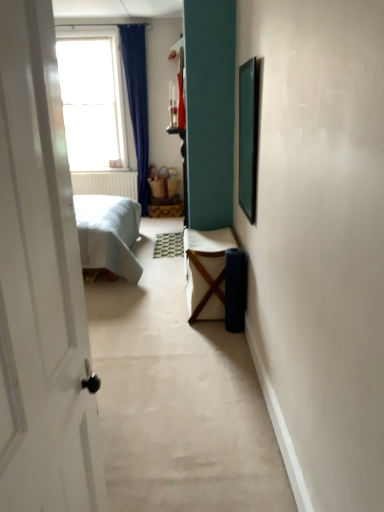
The image size is (384, 512). What do you see at coordinates (93, 100) in the screenshot?
I see `transparent glass window at upper left` at bounding box center [93, 100].

You are a GUI agent. You are given a task and a screenshot of the screen. Output one action in this format:
    pyautogui.click(x=<x>, y=<y>)
    Task: Click on the white fabric chair at center
    The width and height of the screenshot is (384, 512).
    Given the screenshot: What is the action you would take?
    pyautogui.click(x=206, y=272)

The image size is (384, 512). What are the coordinates of `green matte picture frame at upper right` in the screenshot? It's located at (248, 137).

At what (x,y) coordinates should I click in order to perform the action: click on transparent glass window at upper left. Please return your answer as a coordinate pair (x, y). Image resolution: width=384 pixels, height=512 pixels. Looking at the image, I should click on (93, 100).

From a real-world perspective, relative to transparent glass window at upper left, is green matte picture frame at upper right vertically above or below?

green matte picture frame at upper right is situated lower than transparent glass window at upper left in the real world.

Considering the sizes of objects green matte picture frame at upper right and transparent glass window at upper left in the image provided, who is bigger, green matte picture frame at upper right or transparent glass window at upper left?

With larger size is transparent glass window at upper left.

Considering the sizes of objects green matte picture frame at upper right and transparent glass window at upper left in the image provided, who is taller, green matte picture frame at upper right or transparent glass window at upper left?

transparent glass window at upper left.

Can you confirm if green matte picture frame at upper right is positioned to the left of transparent glass window at upper left?

In fact, green matte picture frame at upper right is to the right of transparent glass window at upper left.

What's the angular difference between white fabric chair at center and green matte picture frame at upper right's facing directions?

They differ by 0.00207 degrees in their facing directions.

Considering the points (198, 232) and (253, 178), which point is behind, point (198, 232) or point (253, 178)?

The point (198, 232) is more distant.

From the image's perspective, who appears lower, white fabric chair at center or green matte picture frame at upper right?

white fabric chair at center, from the image's perspective.

Would you say transparent glass window at upper left is a long distance from green matte picture frame at upper right?

Indeed, transparent glass window at upper left is not near green matte picture frame at upper right.

Does transparent glass window at upper left have a greater width compared to green matte picture frame at upper right?

Yes, transparent glass window at upper left is wider than green matte picture frame at upper right.

Considering the positions of objects transparent glass window at upper left and green matte picture frame at upper right in the image provided, who is more to the left, transparent glass window at upper left or green matte picture frame at upper right?

transparent glass window at upper left is more to the left.

Does point (124, 168) come farther from viewer compared to point (246, 184)?

That is True.

Who is smaller, white fabric chair at center or transparent glass window at upper left?

white fabric chair at center is smaller.

Can you see white fabric chair at center touching transparent glass window at upper left?

No, white fabric chair at center is not touching transparent glass window at upper left.

Looking at this image, is white fabric chair at center turned away from transparent glass window at upper left?

No, white fabric chair at center is not facing away from transparent glass window at upper left.

How far apart are white fabric chair at center and transparent glass window at upper left?

2.99 meters.

Looking at this image, from the image's perspective, is green matte picture frame at upper right located above or below white fabric chair at center?

Clearly, from the image's perspective, green matte picture frame at upper right is above white fabric chair at center.

Is point (250, 75) positioned in front of point (221, 300)?

Yes, point (250, 75) is closer to viewer.

Can you tell me how much green matte picture frame at upper right and white fabric chair at center differ in facing direction?

The facing directions of green matte picture frame at upper right and white fabric chair at center are 0.00207 degrees apart.

Is green matte picture frame at upper right bigger or smaller than white fabric chair at center?

Considering their sizes, green matte picture frame at upper right takes up less space than white fabric chair at center.

Which object is further away from the camera taking this photo, transparent glass window at upper left or white fabric chair at center?

transparent glass window at upper left is more distant.

Is transparent glass window at upper left outside of white fabric chair at center?

Yes, transparent glass window at upper left is outside of white fabric chair at center.

Is transparent glass window at upper left next to white fabric chair at center?

No, transparent glass window at upper left is not in contact with white fabric chair at center.

Is transparent glass window at upper left looking in the opposite direction of white fabric chair at center?

transparent glass window at upper left does not have its back to white fabric chair at center.

At what (x,y) coordinates should I click in order to perform the action: click on picture frame lying below the transparent glass window at upper left (from the image's perspective). Please return your answer as a coordinate pair (x, y). This screenshot has height=512, width=384. Looking at the image, I should click on (248, 137).

You are a GUI agent. You are given a task and a screenshot of the screen. Output one action in this format:
    pyautogui.click(x=<x>, y=<y>)
    Task: Click on the picture frame above the white fabric chair at center (from a real-world perspective)
    
    Given the screenshot: What is the action you would take?
    pyautogui.click(x=248, y=137)

Estimate the real-world distances between objects in this image. Which object is closer to white fabric chair at center, green matte picture frame at upper right or transparent glass window at upper left?

green matte picture frame at upper right is closer to white fabric chair at center.

From the picture: Which object lies nearer to the anchor point transparent glass window at upper left, white fabric chair at center or green matte picture frame at upper right?

white fabric chair at center lies closer to transparent glass window at upper left than the other object.

Estimate the real-world distances between objects in this image. Which object is further from green matte picture frame at upper right, white fabric chair at center or transparent glass window at upper left?

transparent glass window at upper left.

From the image, which object appears to be farther from white fabric chair at center, transparent glass window at upper left or green matte picture frame at upper right?

Among the two, transparent glass window at upper left is located further to white fabric chair at center.

When comparing their distances from transparent glass window at upper left, does green matte picture frame at upper right or white fabric chair at center seem closer?

Based on the image, white fabric chair at center appears to be nearer to transparent glass window at upper left.

From the image, which object appears to be farther from green matte picture frame at upper right, transparent glass window at upper left or white fabric chair at center?

Among the two, transparent glass window at upper left is located further to green matte picture frame at upper right.

At what (x,y) coordinates should I click in order to perform the action: click on furniture positioned between green matte picture frame at upper right and transparent glass window at upper left from near to far. Please return your answer as a coordinate pair (x, y). The image size is (384, 512). Looking at the image, I should click on (206, 272).